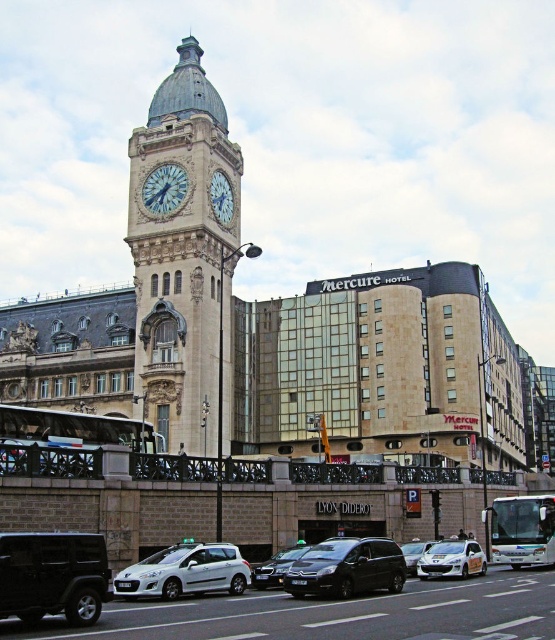
Is silver metallic hatchback at center to the left of metallic silver sedan at center from the viewer's perspective?

Indeed, silver metallic hatchback at center is positioned on the left side of metallic silver sedan at center.

Is point (174, 595) closer to camera compared to point (258, 564)?

That is True.

I want to click on silver metallic hatchback at center, so (x=185, y=572).

Can you confirm if polished bronze clock tower at center-left is shorter than metallic silver sedan at center?

No.

Which is more to the left, polished bronze clock tower at center-left or metallic silver sedan at center?

polished bronze clock tower at center-left is more to the left.

Measure the distance between point (143,355) and camera.

Point (143,355) and camera are 65.97 meters apart from each other.

Find the location of a particular element. polished bronze clock tower at center-left is located at coordinates (181, 257).

Can you confirm if white painted metal clock at upper center is positioned to the right of silver metallic sedan at center?

Incorrect, white painted metal clock at upper center is not on the right side of silver metallic sedan at center.

Which is more to the left, white painted metal clock at upper center or silver metallic sedan at center?

Positioned to the left is white painted metal clock at upper center.

This screenshot has width=555, height=640. What do you see at coordinates (164, 188) in the screenshot?
I see `white painted metal clock at upper center` at bounding box center [164, 188].

Locate an element on the screen. The width and height of the screenshot is (555, 640). white painted metal clock at upper center is located at coordinates (164, 188).